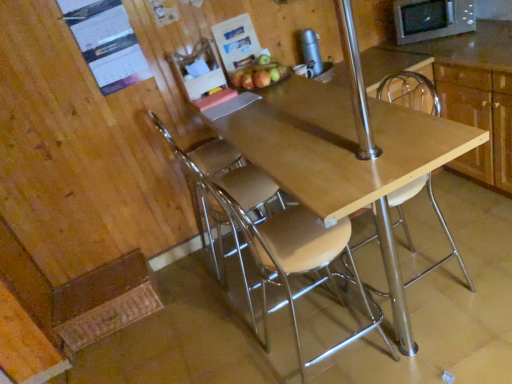
Question: Does shiny red apple at upper center have a lesser height compared to metallic silver chair at center, the first chair when ordered from left to right?

Choices:
 (A) no
 (B) yes

Answer: (B)

Question: Is there a large distance between shiny red apple at upper center and metallic silver chair at center, the third chair from the right?

Choices:
 (A) yes
 (B) no

Answer: (B)

Question: Is shiny red apple at upper center outside metallic silver chair at center, the first chair when ordered from left to right?

Choices:
 (A) no
 (B) yes

Answer: (B)

Question: Would you say shiny red apple at upper center contains metallic silver chair at center, the first chair when ordered from left to right?

Choices:
 (A) yes
 (B) no

Answer: (B)

Question: Does shiny red apple at upper center appear on the right side of metallic silver chair at center, the first chair when ordered from left to right?

Choices:
 (A) no
 (B) yes

Answer: (B)

Question: From a real-world perspective, is shiny red apple at upper center physically above metallic silver chair at center, the third chair from the right?

Choices:
 (A) yes
 (B) no

Answer: (A)

Question: Is wooden cabinet at upper right surrounded by metallic silver thermos at upper center?

Choices:
 (A) yes
 (B) no

Answer: (B)

Question: Is metallic silver thermos at upper center thinner than wooden cabinet at upper right?

Choices:
 (A) yes
 (B) no

Answer: (A)

Question: Are metallic silver thermos at upper center and wooden cabinet at upper right making contact?

Choices:
 (A) no
 (B) yes

Answer: (A)

Question: Is metallic silver thermos at upper center outside of wooden cabinet at upper right?

Choices:
 (A) yes
 (B) no

Answer: (A)

Question: Considering the relative sizes of metallic silver thermos at upper center and wooden cabinet at upper right in the image provided, is metallic silver thermos at upper center wider than wooden cabinet at upper right?

Choices:
 (A) yes
 (B) no

Answer: (B)

Question: From the image's perspective, is metallic silver thermos at upper center above wooden cabinet at upper right?

Choices:
 (A) no
 (B) yes

Answer: (B)

Question: Considering the relative sizes of wooden seat at center, which appears as the 2th chair when viewed from the right, and wooden cabinet at upper right in the image provided, is wooden seat at center, which appears as the 2th chair when viewed from the right, taller than wooden cabinet at upper right?

Choices:
 (A) yes
 (B) no

Answer: (A)